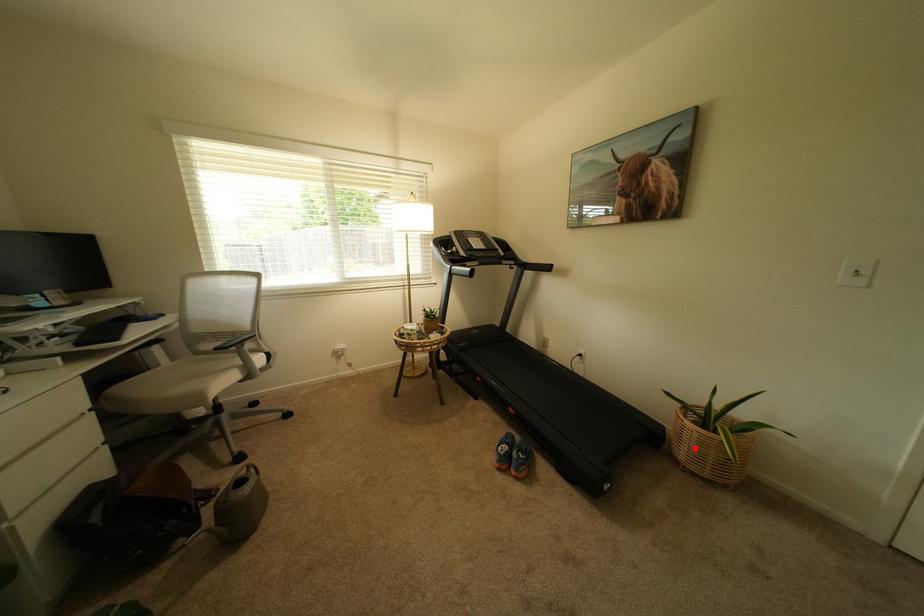
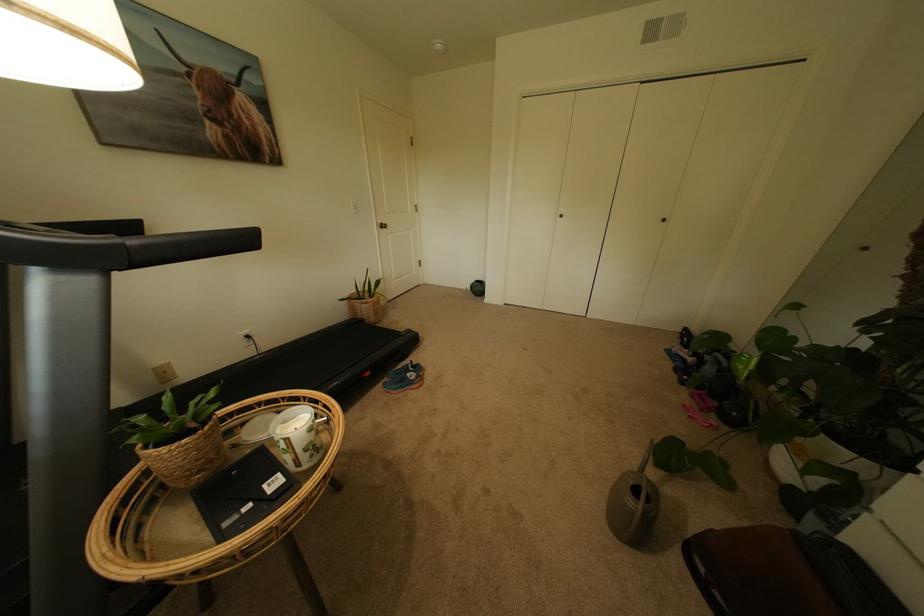
Question: I am providing you with two images of the same scene from different viewpoints. A red point is marked on the first image. At the location where the point appears in image 1, is it still visible in image 2?

Choices:
 (A) Yes
 (B) No

Answer: (A)